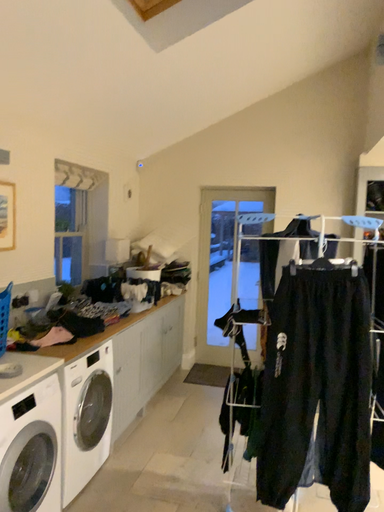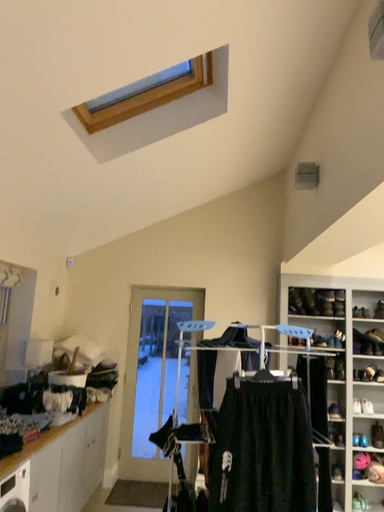
Question: Which way did the camera rotate in the video?

Choices:
 (A) rotated downward
 (B) rotated upward

Answer: (B)